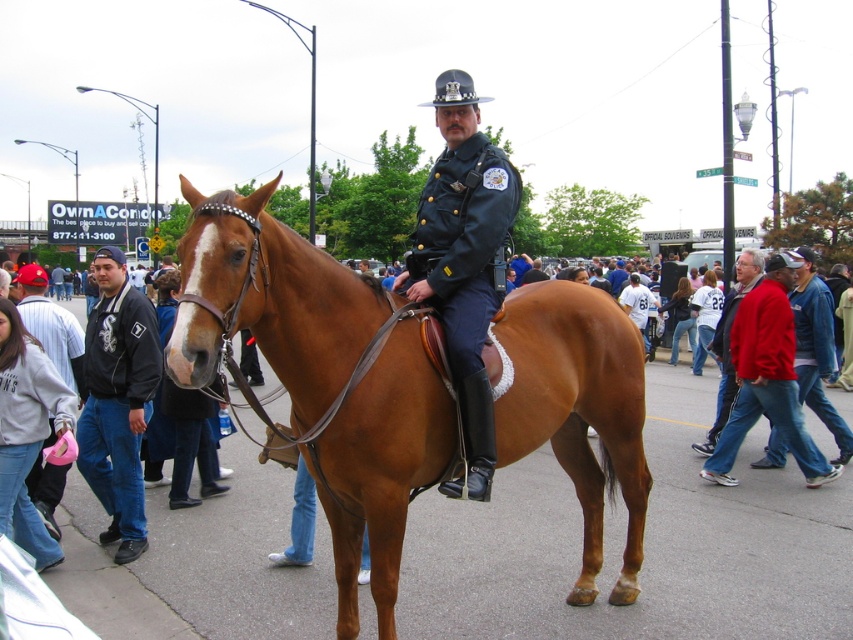
Question: Which of these objects is positioned farthest from the brushed metal water at bottle left?

Choices:
 (A) shiny dark blue uniform at center
 (B) red jacket at center
 (C) black leather jacket at left

Answer: (B)

Question: Does brushed metal water at bottle left have a larger size compared to red jacket at center?

Choices:
 (A) yes
 (B) no

Answer: (A)

Question: Which object appears closest to the camera in this image?

Choices:
 (A) shiny dark blue uniform at center
 (B) black leather jacket at left
 (C) brushed metal water at bottle left

Answer: (A)

Question: Is shiny dark blue uniform at center bigger than brushed metal water at bottle left?

Choices:
 (A) yes
 (B) no

Answer: (B)

Question: Which is farther from the brown leather horse at center?

Choices:
 (A) red jacket at center
 (B) shiny dark blue uniform at center

Answer: (A)

Question: Does brown leather horse at center appear under red cotton jacket at lower right?

Choices:
 (A) yes
 (B) no

Answer: (A)